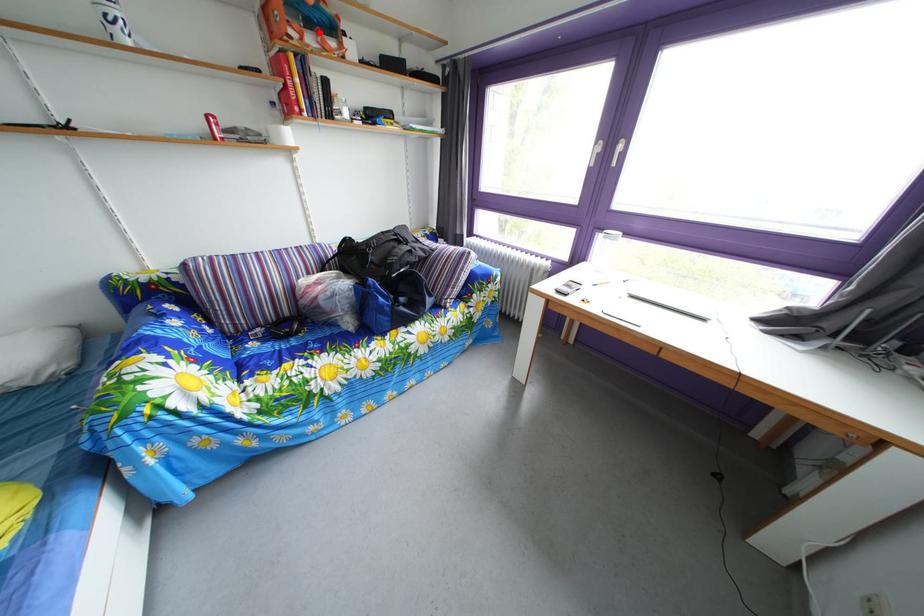
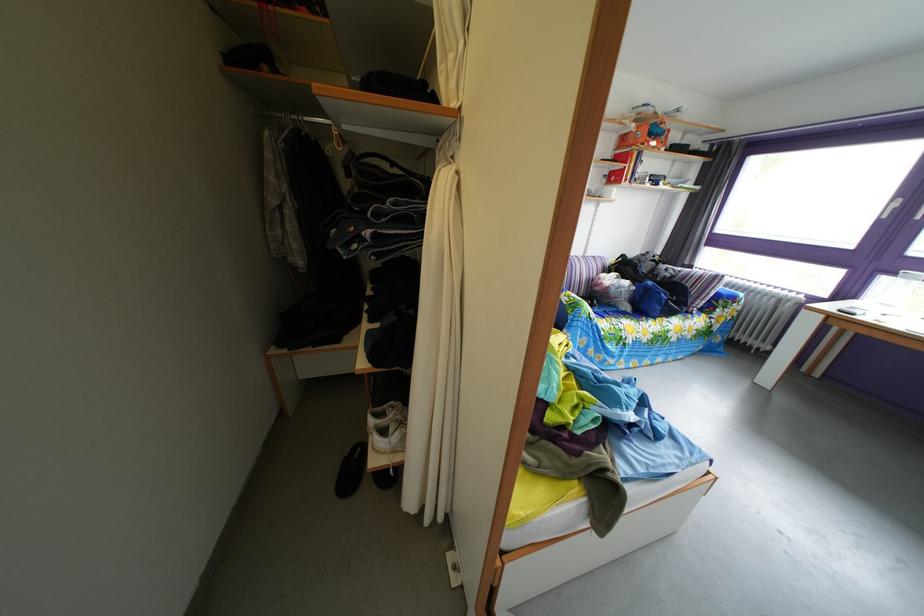
In the second image, find the point that corresponds to the highlighted location in the first image.

(661, 144)